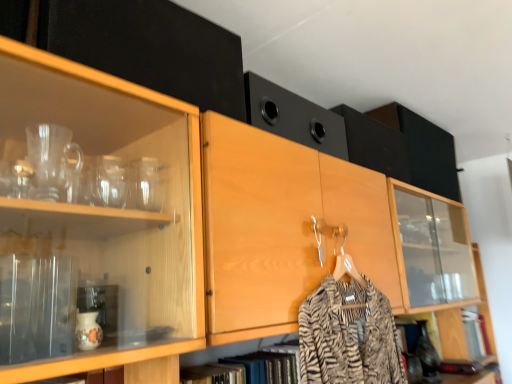
Question: Considering the relative sizes of black matte speaker at upper center, which ranks as the second cabinetry in back-to-front order, and wooden cabinet at lower right, which appears as the 1th cabinetry when ordered from the bottom, in the image provided, is black matte speaker at upper center, which ranks as the second cabinetry in back-to-front order, taller than wooden cabinet at lower right, which appears as the 1th cabinetry when ordered from the bottom,?

Choices:
 (A) yes
 (B) no

Answer: (A)

Question: Does black matte speaker at upper center, which appears as the 2th cabinetry when ordered from the bottom, come behind wooden cabinet at lower right, placed as the first cabinetry when sorted from back to front?

Choices:
 (A) no
 (B) yes

Answer: (A)

Question: Does black matte speaker at upper center, the 3th cabinetry when ordered from left to right, have a smaller size compared to wooden cabinet at lower right, which appears as the 1th cabinetry when ordered from the bottom?

Choices:
 (A) no
 (B) yes

Answer: (A)

Question: Does black matte speaker at upper center, which appears as the 2th cabinetry when ordered from the bottom, have a lesser height compared to wooden cabinet at lower right, which appears as the 1th cabinetry when ordered from the bottom?

Choices:
 (A) no
 (B) yes

Answer: (A)

Question: Are black matte speaker at upper center, the 3th cabinetry when ordered from left to right, and wooden cabinet at lower right, the first cabinetry viewed from the right, far apart?

Choices:
 (A) no
 (B) yes

Answer: (A)

Question: From the image's perspective, relative to matte black cabinet at upper left, acting as the fourth cabinetry starting from the back, is black matte speaker at upper center, the 2th cabinetry from the right, above or below?

Choices:
 (A) above
 (B) below

Answer: (B)

Question: Considering the positions of black matte speaker at upper center, which appears as the 2th cabinetry when ordered from the bottom, and matte black cabinet at upper left, the 1th cabinetry from the front, in the image, is black matte speaker at upper center, which appears as the 2th cabinetry when ordered from the bottom, wider or thinner than matte black cabinet at upper left, the 1th cabinetry from the front,?

Choices:
 (A) thin
 (B) wide

Answer: (B)

Question: Considering the positions of black matte speaker at upper center, the 2th cabinetry from the right, and matte black cabinet at upper left, which ranks as the first cabinetry in left-to-right order, in the image, is black matte speaker at upper center, the 2th cabinetry from the right, bigger or smaller than matte black cabinet at upper left, which ranks as the first cabinetry in left-to-right order,?

Choices:
 (A) big
 (B) small

Answer: (A)

Question: Does point (365, 139) appear closer or farther from the camera than point (130, 59)?

Choices:
 (A) farther
 (B) closer

Answer: (A)

Question: Considering the positions of black matte speaker at upper center, the 3th cabinetry when ordered from top to bottom, and wooden cabinet at lower right, the 4th cabinetry in the left-to-right sequence, in the image, is black matte speaker at upper center, the 3th cabinetry when ordered from top to bottom, taller or shorter than wooden cabinet at lower right, the 4th cabinetry in the left-to-right sequence,?

Choices:
 (A) short
 (B) tall

Answer: (B)

Question: In the image, is black matte speaker at upper center, which ranks as the second cabinetry in back-to-front order, on the left side or the right side of wooden cabinet at lower right, which appears as the 1th cabinetry when ordered from the bottom?

Choices:
 (A) right
 (B) left

Answer: (B)

Question: In the image, is black matte speaker at upper center, the 3th cabinetry viewed from the front, positioned in front of or behind wooden cabinet at lower right, the fourth cabinetry in the top-to-bottom sequence?

Choices:
 (A) behind
 (B) front

Answer: (B)

Question: From the image's perspective, is black matte speaker at upper center, which appears as the 2th cabinetry when ordered from the bottom, located above or below wooden cabinet at lower right, which is counted as the 4th cabinetry, starting from the front?

Choices:
 (A) below
 (B) above

Answer: (B)

Question: Considering the positions of wooden cabinet at lower right, placed as the first cabinetry when sorted from back to front, and black matte speaker at upper center, which appears as the 2th cabinetry when ordered from the bottom, in the image, is wooden cabinet at lower right, placed as the first cabinetry when sorted from back to front, taller or shorter than black matte speaker at upper center, which appears as the 2th cabinetry when ordered from the bottom,?

Choices:
 (A) tall
 (B) short

Answer: (B)

Question: Is point (456, 311) closer or farther from the camera than point (367, 162)?

Choices:
 (A) closer
 (B) farther

Answer: (B)